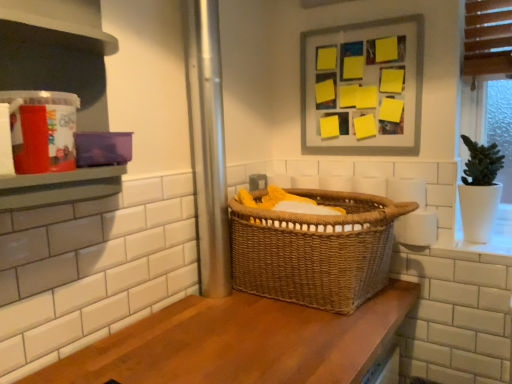
I want to click on free spot to the left of woven brown basket at center, so click(x=185, y=325).